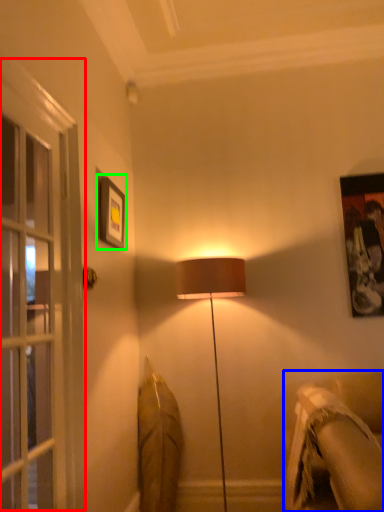
Question: Which object is the closest to the screen door (highlighted by a red box)? Choose among these: studio couch (highlighted by a blue box) or picture frame (highlighted by a green box).

Choices:
 (A) studio couch
 (B) picture frame

Answer: (B)